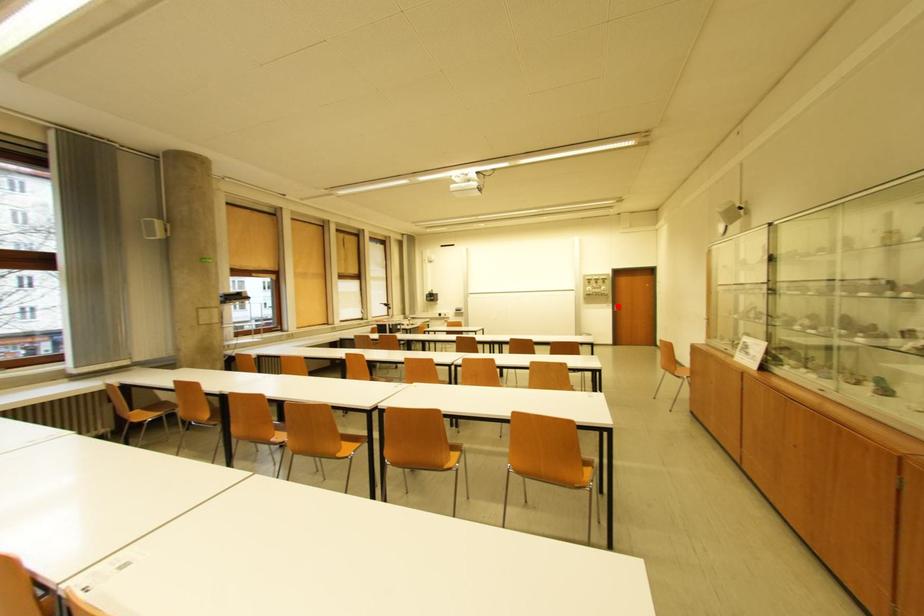
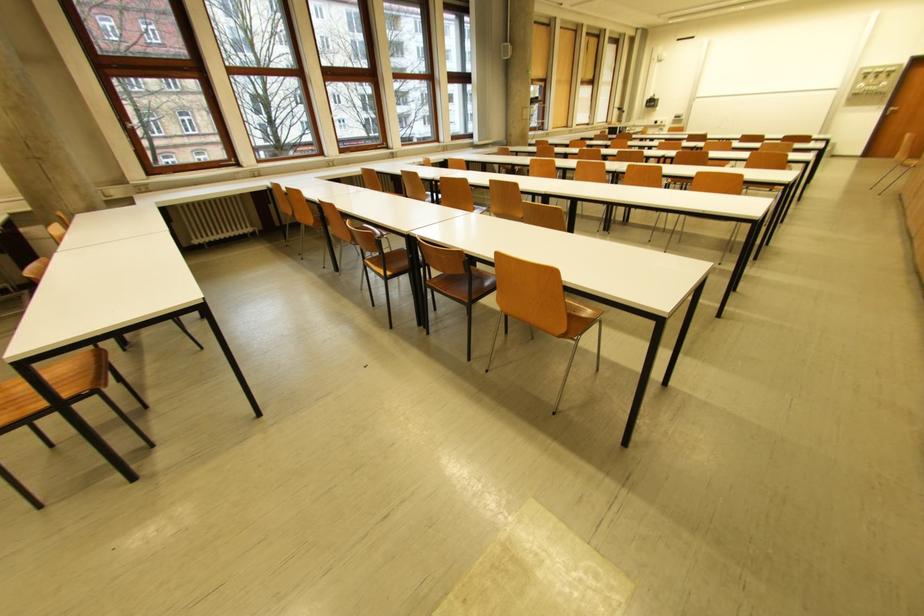
Question: I am providing you with two images of the same scene from different viewpoints. A red point is shown in image1. For the corresponding object point in image2, is it positioned nearer or farther from the camera?

Choices:
 (A) Nearer
 (B) Farther

Answer: (B)